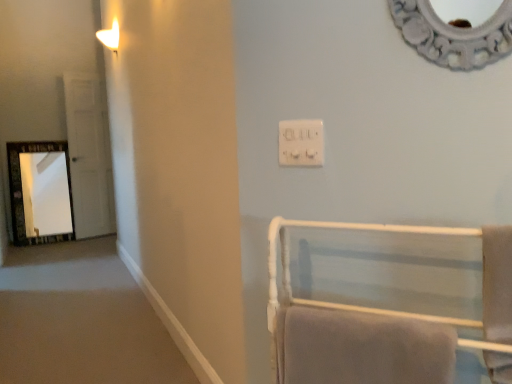
Question: From the image's perspective, would you say white glossy door at left is positioned over white plastic electrical outlet at upper center?

Choices:
 (A) no
 (B) yes

Answer: (B)

Question: From a real-world perspective, is white glossy door at left positioned over white plastic electrical outlet at upper center based on gravity?

Choices:
 (A) no
 (B) yes

Answer: (A)

Question: Is white glossy door at left positioned before white plastic electrical outlet at upper center?

Choices:
 (A) yes
 (B) no

Answer: (B)

Question: Can you confirm if white glossy door at left is thinner than white plastic electrical outlet at upper center?

Choices:
 (A) yes
 (B) no

Answer: (B)

Question: Does white glossy door at left have a greater width compared to white plastic electrical outlet at upper center?

Choices:
 (A) yes
 (B) no

Answer: (A)

Question: Considering the positions of white towel rack at lower right and white soft towel at lower right, positioned as the first bath towel in left-to-right order, in the image, is white towel rack at lower right bigger or smaller than white soft towel at lower right, positioned as the first bath towel in left-to-right order,?

Choices:
 (A) big
 (B) small

Answer: (A)

Question: Considering their positions, is white towel rack at lower right located in front of or behind white soft towel at lower right, which is the second bath towel in right-to-left order?

Choices:
 (A) behind
 (B) front

Answer: (B)

Question: From the image's perspective, is white towel rack at lower right above or below white soft towel at lower right, which is the second bath towel in right-to-left order?

Choices:
 (A) below
 (B) above

Answer: (B)

Question: Looking at their shapes, would you say white towel rack at lower right is wider or thinner than white soft towel at lower right, which is the second bath towel in right-to-left order?

Choices:
 (A) thin
 (B) wide

Answer: (B)

Question: In the image, is white glossy door at left on the left side or the right side of white soft towel at right, which is the first bath towel from right to left?

Choices:
 (A) right
 (B) left

Answer: (B)

Question: Looking at the image, does white glossy door at left seem bigger or smaller compared to white soft towel at right, arranged as the second bath towel when viewed from the left?

Choices:
 (A) small
 (B) big

Answer: (B)

Question: From the image's perspective, relative to white soft towel at right, arranged as the second bath towel when viewed from the left, is white glossy door at left above or below?

Choices:
 (A) below
 (B) above

Answer: (B)

Question: Is white glossy door at left taller or shorter than white soft towel at right, arranged as the second bath towel when viewed from the left?

Choices:
 (A) tall
 (B) short

Answer: (A)

Question: From a real-world perspective, is white soft towel at lower right, which is the second bath towel in right-to-left order, above or below white towel rack at lower right?

Choices:
 (A) below
 (B) above

Answer: (A)

Question: Looking at their shapes, would you say white soft towel at lower right, which is the second bath towel in right-to-left order, is wider or thinner than white towel rack at lower right?

Choices:
 (A) wide
 (B) thin

Answer: (B)